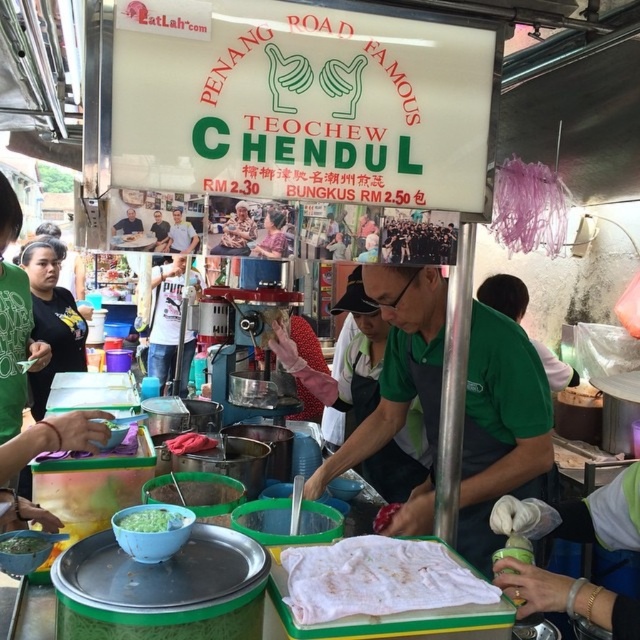
You are a customer at the Penang Road Famous Teochew Chendul stall. You see two points on the stall sign. One is at coordinate point (173, 225) and the other is at coordinate point (28, 550). Which point is closer to you as you face the stall sign?

Point (173, 225) is in front of point (28, 550), so it is closer to you as you face the stall sign.

You are a customer at the Penang Road Famous Teochew Chendul stall. You notice a light blue shirt at center and a green matte bowl at lower left. Which object is wider?

The light blue shirt at center has a lesser width compared to the green matte bowl at lower left, so the green matte bowl at lower left is wider.